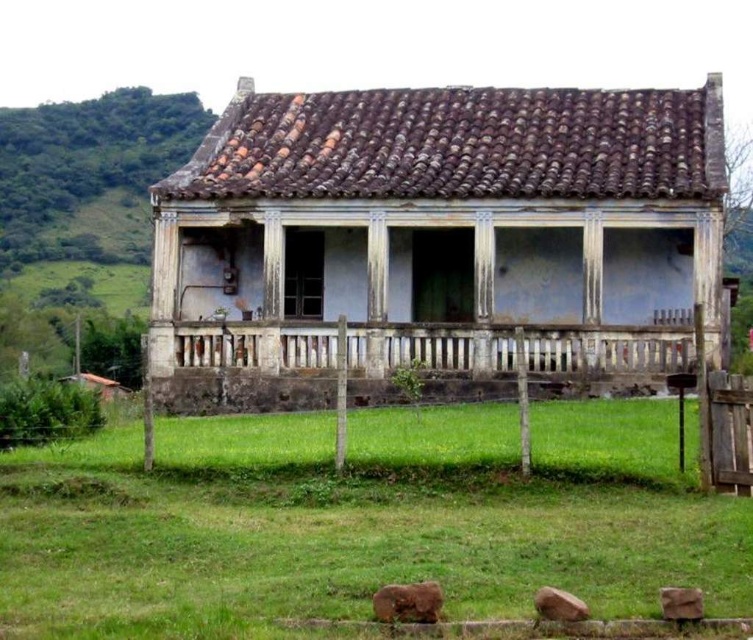
Does point (547, 536) come in front of point (255, 340)?

Yes.

Does green grass at lower center appear over white weathered wood porch at center?

No.

Is point (366, 598) closer to camera compared to point (270, 339)?

Yes, it is in front of point (270, 339).

Identify the location of green grass at lower center. The image size is (753, 640). (364, 518).